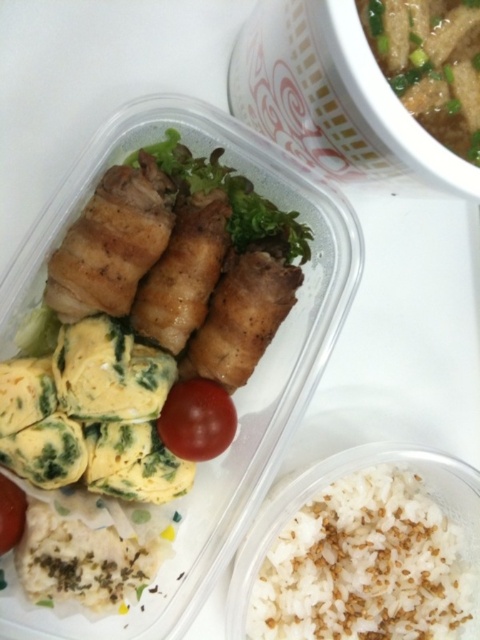
Question: Which of the following is the closest to the observer?

Choices:
 (A) (439, 76)
 (B) (197, 163)

Answer: (A)

Question: Which object is farther from the camera taking this photo?

Choices:
 (A) white rice at bottom right
 (B) green leafy vegetable at upper right
 (C) glossy red tomato at center

Answer: (A)

Question: Which object is closer to the camera taking this photo?

Choices:
 (A) green leafy vegetable at center
 (B) green leafy vegetable at upper right

Answer: (B)

Question: From the image, what is the correct spatial relationship of green leafy vegetable at upper right in relation to red matte tomato at lower left?

Choices:
 (A) below
 (B) above

Answer: (B)

Question: Is green leafy vegetable at upper right smaller than red matte tomato at lower left?

Choices:
 (A) no
 (B) yes

Answer: (A)

Question: Is green leafy vegetable at upper right bigger than red matte tomato at lower left?

Choices:
 (A) yes
 (B) no

Answer: (A)